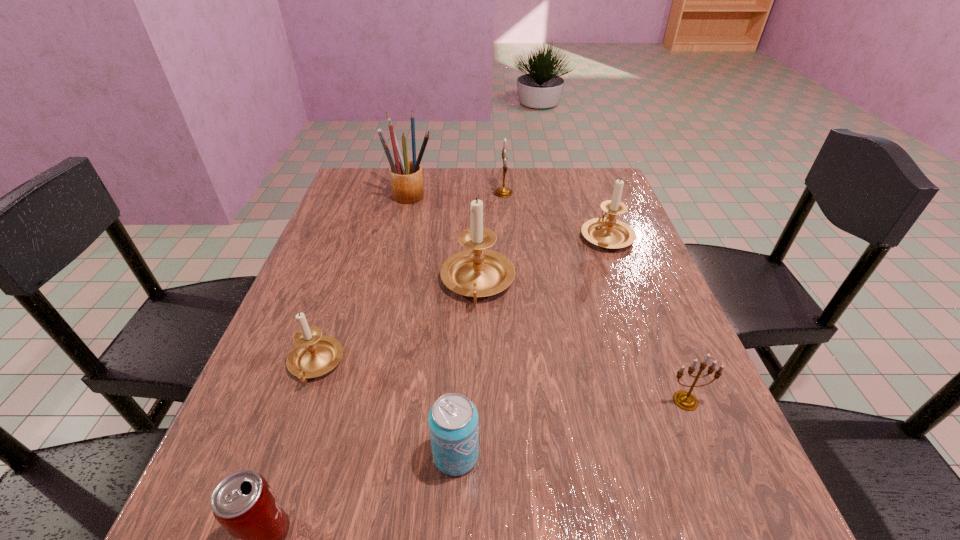
The image size is (960, 540). I want to click on the nearer gold candelabrum, so coord(685,400).

Find the location of `the right beer can`. the right beer can is located at coordinates (453, 420).

Identify the location of the seventh farthest object. This screenshot has height=540, width=960. (453, 420).

Where is `vacant space located 0.310m on the front of the brown pencil box`? The height and width of the screenshot is (540, 960). vacant space located 0.310m on the front of the brown pencil box is located at coordinates (392, 280).

I want to click on free space located 0.110m with a handle on the side of the biggest beige candle holder, so [x=477, y=357].

Identify the location of vacant area situated with a handle on the side of the second farthest candelabrum. (589, 191).

Locate an element on the screen. The height and width of the screenshot is (540, 960). vacant space located with a handle on the side of the second farthest candelabrum is located at coordinates (594, 202).

Where is `free space located 0.240m with a handle on the side of the second farthest candelabrum`? Image resolution: width=960 pixels, height=540 pixels. free space located 0.240m with a handle on the side of the second farthest candelabrum is located at coordinates (584, 175).

Where is `vacant space located 0.230m on the right of the farthest candelabrum`? The width and height of the screenshot is (960, 540). vacant space located 0.230m on the right of the farthest candelabrum is located at coordinates (591, 193).

This screenshot has height=540, width=960. What are the coordinates of `free space located with a handle on the side of the leftmost candelabrum` in the screenshot? It's located at (293, 428).